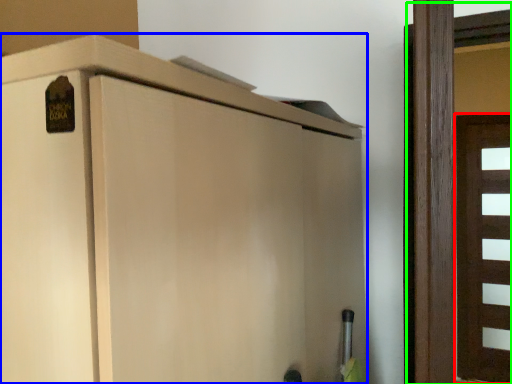
Question: Estimate the real-world distances between objects in this image. Which object is closer to door (highlighted by a red box), cupboard (highlighted by a blue box) or door (highlighted by a green box)?

Choices:
 (A) cupboard
 (B) door

Answer: (B)